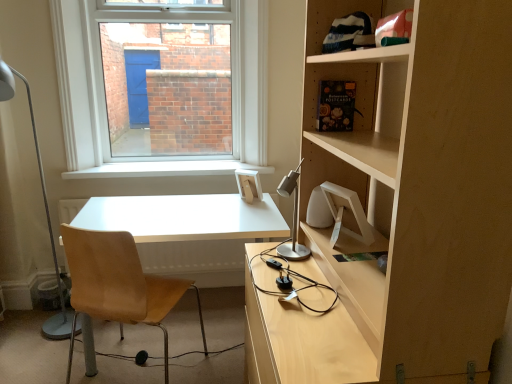
Question: In terms of height, does white matte desk at center look taller or shorter compared to white metal table lamp at left, marked as the first table lamp in a left-to-right arrangement?

Choices:
 (A) tall
 (B) short

Answer: (B)

Question: Considering the positions of white matte desk at center and white metal table lamp at left, placed as the 2th table lamp when sorted from right to left, in the image, is white matte desk at center bigger or smaller than white metal table lamp at left, placed as the 2th table lamp when sorted from right to left,?

Choices:
 (A) small
 (B) big

Answer: (B)

Question: Considering the real-world distances, which object is closest to the light brown leather chair at left?

Choices:
 (A) satin silver table lamp at center, which ranks as the 1th table lamp in right-to-left order
 (B) white smooth window sill at center
 (C) white metal table lamp at left, placed as the 2th table lamp when sorted from right to left
 (D) white matte desk at center

Answer: (D)

Question: Which object is the farthest from the light brown leather chair at left?

Choices:
 (A) white smooth window sill at center
 (B) white matte desk at center
 (C) white metal table lamp at left, marked as the first table lamp in a left-to-right arrangement
 (D) satin silver table lamp at center, which ranks as the 1th table lamp in right-to-left order

Answer: (A)